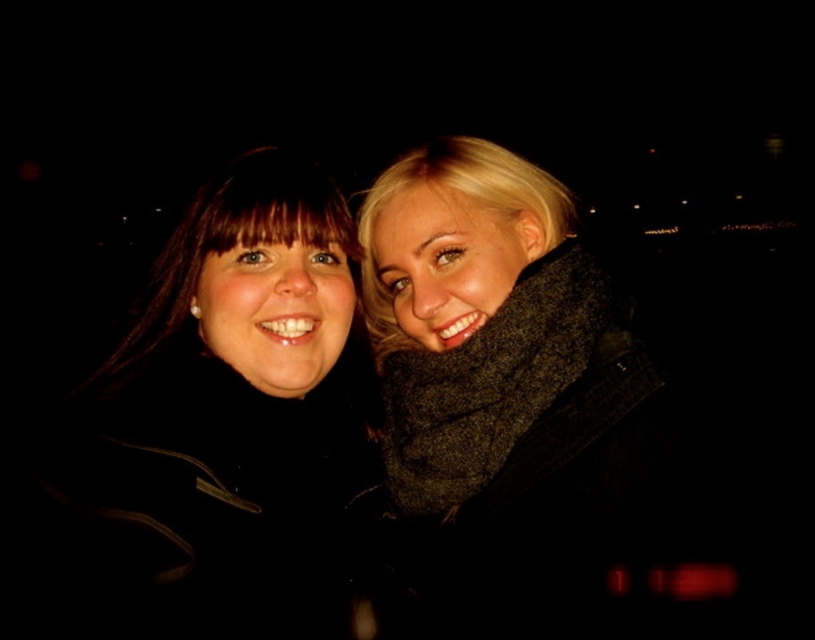
You are a photographer adjusting the lighting for a portrait. You notice two dark items on the left side of the image, a black matte jacket at left and a matte black coat at left. Which one is closer to the camera?

The black matte jacket at left is closer to the camera because it is 5.95 inches away from the matte black coat at left.

You are a photographer who wants to capture a closeup shot of both the dark gray wool scarf at right and the black matte jacket at left in the image. Given that your camera can only focus on objects within a 10 inch range, will you be able to capture both items clearly in one shot?

The dark gray wool scarf at right and the black matte jacket at left are 8.90 inches apart from each other. Since the distance between them is within the 10 inch range, the camera can focus on both items clearly in one shot.

You are a photographer adjusting your camera settings to focus on the dark gray wool scarf at right and the black matte jacket at left. Which object should you focus on first to ensure proper depth of field?

The dark gray wool scarf at right is closer to the viewer than the black matte jacket at left, so you should focus on the dark gray wool scarf at right first to ensure proper depth of field.